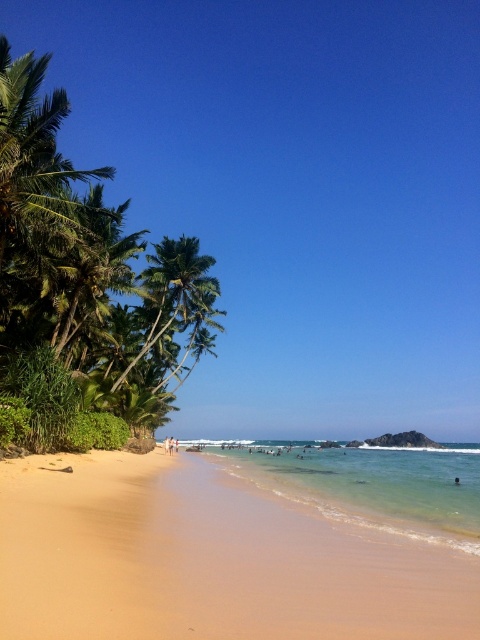
What do you see at coordinates (210, 560) in the screenshot? This screenshot has height=640, width=480. I see `sandy beach at lower left` at bounding box center [210, 560].

Is sandy beach at lower left above green leafy palm tree at left?

No, sandy beach at lower left is not above green leafy palm tree at left.

Between point (392, 579) and point (83, 349), which one is positioned behind?

Point (83, 349)

The width and height of the screenshot is (480, 640). I want to click on sandy beach at lower left, so click(210, 560).

Can you confirm if sandy beach at lower left is positioned to the right of clear water at beach center?

Incorrect, sandy beach at lower left is not on the right side of clear water at beach center.

Can you confirm if sandy beach at lower left is bigger than clear water at beach center?

No, sandy beach at lower left is not bigger than clear water at beach center.

The image size is (480, 640). Find the location of `sandy beach at lower left`. sandy beach at lower left is located at coordinates (210, 560).

The height and width of the screenshot is (640, 480). In order to click on sandy beach at lower left in this screenshot , I will do `click(210, 560)`.

Between green leafy palm tree at left and clear water at beach center, which one is positioned higher?

Positioned higher is green leafy palm tree at left.

Is point (25, 282) positioned before point (255, 481)?

No, (25, 282) is behind (255, 481).

Find the location of `green leafy palm tree at left`. green leafy palm tree at left is located at coordinates (85, 280).